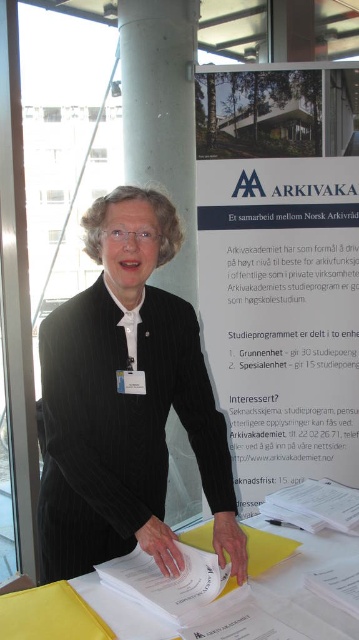
The woman in the image is preparing for her presentation. She needs to place her notes on the table so that the black woolen sweater at center and the blue paper at upper center are visible to the audience. Where should she position the notes to ensure both items remain visible?

The woman should place her notes to the right of the black woolen sweater at center since it is positioned to the left of the blue paper at upper center, ensuring both items stay visible.

From the picture: You are an event organizer who needs to place a 15 cm tall decorative item on the table. The item must be placed between the black woolen sweater at center and the white smooth pillar at center. Can you fit it there?

The black woolen sweater at center is shorter than the white smooth pillar at center. The space between them should be sufficient to place the 15 cm tall decorative item as height difference does not affect placement.

You are an event organizer who needs to place a name tag holder on the table. The holder requires a flat surface larger than the white smooth pillar at center. Is there enough space next to the black woolen sweater at center for the holder?

The black woolen sweater at center is to the left of the white smooth pillar at center. Since the holder needs a flat surface larger than the white smooth pillar at center, there might be sufficient space next to the black woolen sweater at center if the table has enough room beyond the sweater.